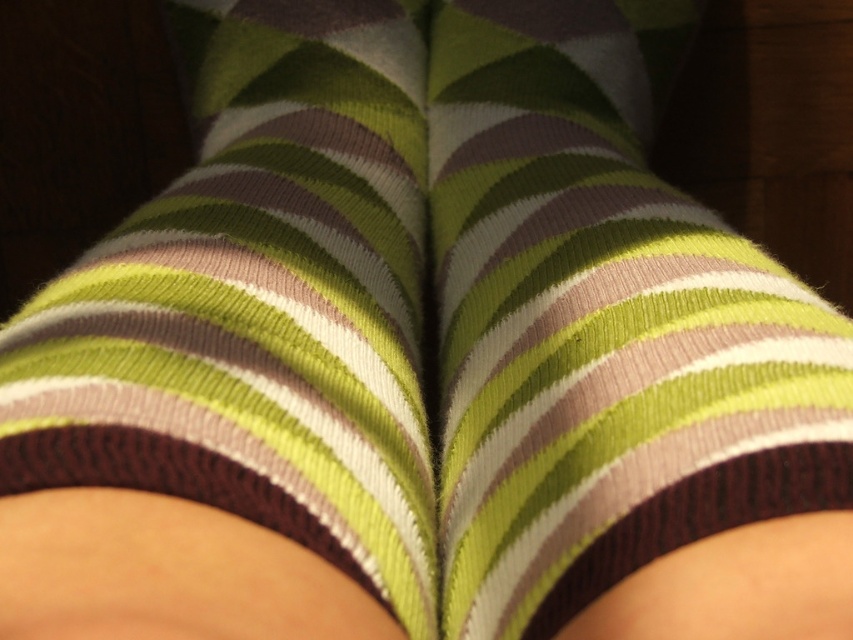
Question: Which of the following is the closest to the observer?

Choices:
 (A) knitted green and brown striped sock at center
 (B) knit green striped sock at center

Answer: (A)

Question: Does knit green striped sock at center appear on the left side of knitted green and brown striped sock at center?

Choices:
 (A) yes
 (B) no

Answer: (B)

Question: Which object is farther from the camera taking this photo?

Choices:
 (A) knitted green and brown striped sock at center
 (B) knit green striped sock at center

Answer: (B)

Question: In this image, where is knit green striped sock at center located relative to knitted green and brown striped sock at center?

Choices:
 (A) above
 (B) below

Answer: (B)

Question: Does knit green striped sock at center appear on the left side of knitted green and brown striped sock at center?

Choices:
 (A) no
 (B) yes

Answer: (A)